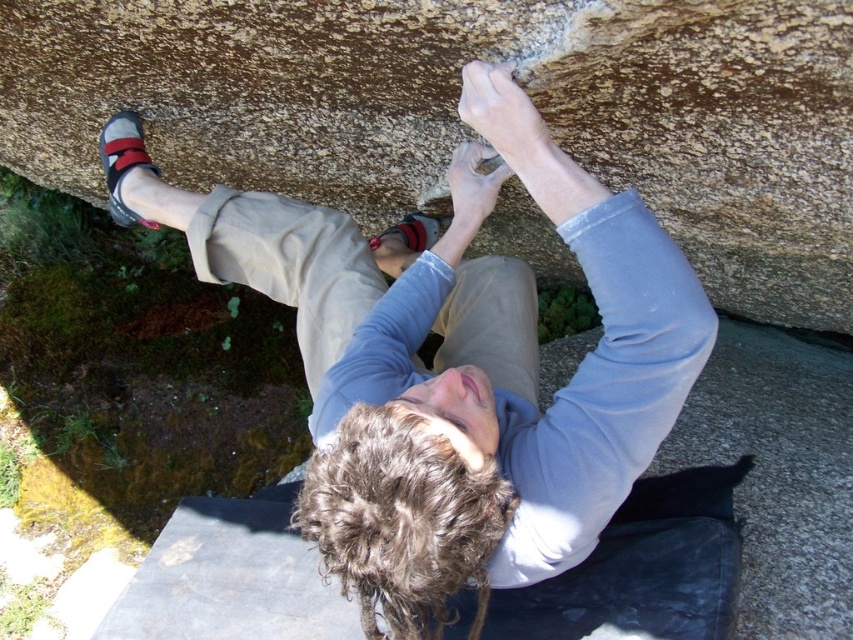
You are a rock climber trying to reach the top of the rock. You see a brown rough rock at upper center and a matte gray climbing shoe at upper left. Which object is closer to your current position?

The matte gray climbing shoe at upper left is closer to your current position because it is only 37.80 centimeters away from the brown rough rock at upper center, implying the shoe is nearer to the climber.

Looking at this image, you are a rock climber trying to reach the top of the rock face. You notice the brown rough rock at upper center and the matte gray climbing shoe at upper left. Which object is located higher up on the rock face?

The brown rough rock at upper center is positioned over the matte gray climbing shoe at upper left, so it is higher up on the rock face.